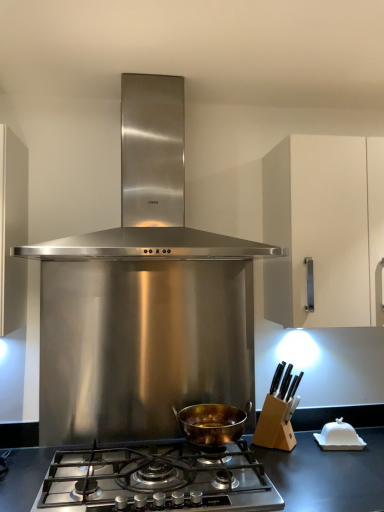
This screenshot has height=512, width=384. In order to click on gold-bronze pot at center, which ranks as the 1th kitchen appliance in bottom-to-top order in this screenshot , I will do `click(212, 423)`.

Where is `white matte cabinet at right`? white matte cabinet at right is located at coordinates (324, 228).

This screenshot has width=384, height=512. What are the coordinates of `stainless steel gas stove at center` in the screenshot? It's located at (157, 480).

From the image's perspective, is gold-bronze pot at center, which ranks as the second kitchen appliance in top-to-bottom order, under white matte cabinet at right?

Yes, from the image's perspective, gold-bronze pot at center, which ranks as the second kitchen appliance in top-to-bottom order, is below white matte cabinet at right.

Is gold-bronze pot at center, which ranks as the second kitchen appliance in top-to-bottom order, situated inside white matte cabinet at right or outside?

gold-bronze pot at center, which ranks as the second kitchen appliance in top-to-bottom order, is not enclosed by white matte cabinet at right.

Is gold-bronze pot at center, which ranks as the 1th kitchen appliance in bottom-to-top order, looking in the opposite direction of white matte cabinet at right?

No, white matte cabinet at right is not at the back of gold-bronze pot at center, which ranks as the 1th kitchen appliance in bottom-to-top order.

How far apart are gold-bronze pot at center, which ranks as the 1th kitchen appliance in bottom-to-top order, and white matte cabinet at right?

A distance of 28.57 inches exists between gold-bronze pot at center, which ranks as the 1th kitchen appliance in bottom-to-top order, and white matte cabinet at right.

Is white matte cabinet at right positioned beyond the bounds of gold-bronze pot at center, which ranks as the 1th kitchen appliance in bottom-to-top order?

Indeed, white matte cabinet at right is completely outside gold-bronze pot at center, which ranks as the 1th kitchen appliance in bottom-to-top order.

How far apart are white matte cabinet at right and gold-bronze pot at center, which ranks as the second kitchen appliance in top-to-bottom order?

white matte cabinet at right is 28.57 inches away from gold-bronze pot at center, which ranks as the second kitchen appliance in top-to-bottom order.

Is white matte cabinet at right beside gold-bronze pot at center, which ranks as the 1th kitchen appliance in bottom-to-top order?

No, white matte cabinet at right is not beside gold-bronze pot at center, which ranks as the 1th kitchen appliance in bottom-to-top order.

Between gold-bronze pot at center, which ranks as the 1th kitchen appliance in bottom-to-top order, and stainless steel gas stove at center, which one appears on the right side from the viewer's perspective?

gold-bronze pot at center, which ranks as the 1th kitchen appliance in bottom-to-top order, is more to the right.

Can you tell me how much gold-bronze pot at center, which ranks as the second kitchen appliance in top-to-bottom order, and stainless steel gas stove at center differ in facing direction?

gold-bronze pot at center, which ranks as the second kitchen appliance in top-to-bottom order, and stainless steel gas stove at center are facing 0.000546 degrees away from each other.

From a real-world perspective, who is located lower, gold-bronze pot at center, which ranks as the second kitchen appliance in top-to-bottom order, or stainless steel gas stove at center?

In real-world perspective, stainless steel gas stove at center is lower.

From the image's perspective, who appears lower, gold-bronze pot at center, which ranks as the 1th kitchen appliance in bottom-to-top order, or stainless steel gas stove at center?

From the image's view, stainless steel gas stove at center is below.

Considering the relative sizes of stainless steel range hood at center, which is counted as the 2th kitchen appliance, starting from the bottom, and stainless steel gas stove at center in the image provided, is stainless steel range hood at center, which is counted as the 2th kitchen appliance, starting from the bottom, shorter than stainless steel gas stove at center?

Incorrect, the height of stainless steel range hood at center, which is counted as the 2th kitchen appliance, starting from the bottom, does not fall short of that of stainless steel gas stove at center.

Relative to stainless steel gas stove at center, is stainless steel range hood at center, which ranks as the first kitchen appliance in top-to-bottom order, in front or behind?

stainless steel range hood at center, which ranks as the first kitchen appliance in top-to-bottom order, is positioned farther from the viewer than stainless steel gas stove at center.

Does stainless steel range hood at center, which ranks as the first kitchen appliance in top-to-bottom order, touch stainless steel gas stove at center?

There is a gap between stainless steel range hood at center, which ranks as the first kitchen appliance in top-to-bottom order, and stainless steel gas stove at center.

Does point (159, 217) come closer to viewer compared to point (187, 474)?

No, it is not.

Is stainless steel gas stove at center touching stainless steel range hood at center, which ranks as the first kitchen appliance in top-to-bottom order?

No, stainless steel gas stove at center is not making contact with stainless steel range hood at center, which ranks as the first kitchen appliance in top-to-bottom order.

From their relative heights in the image, would you say stainless steel gas stove at center is taller or shorter than stainless steel range hood at center, which ranks as the first kitchen appliance in top-to-bottom order?

Clearly, stainless steel gas stove at center is shorter compared to stainless steel range hood at center, which ranks as the first kitchen appliance in top-to-bottom order.

In the scene shown: Is stainless steel gas stove at center facing towards stainless steel range hood at center, which is counted as the 2th kitchen appliance, starting from the bottom?

No, stainless steel gas stove at center does not turn towards stainless steel range hood at center, which is counted as the 2th kitchen appliance, starting from the bottom.

From a real-world perspective, is stainless steel gas stove at center on stainless steel range hood at center, which ranks as the first kitchen appliance in top-to-bottom order?

No, from a real-world perspective, stainless steel gas stove at center is not on top of stainless steel range hood at center, which ranks as the first kitchen appliance in top-to-bottom order.

Is stainless steel gas stove at center placed right next to gold-bronze pot at center, which ranks as the second kitchen appliance in top-to-bottom order?

No, stainless steel gas stove at center is not beside gold-bronze pot at center, which ranks as the second kitchen appliance in top-to-bottom order.

Where is `the 1st kitchen appliance directly above the stainless steel gas stove at center (from a real-world perspective)`? Image resolution: width=384 pixels, height=512 pixels. the 1st kitchen appliance directly above the stainless steel gas stove at center (from a real-world perspective) is located at coordinates (212, 423).

Is gold-bronze pot at center, which ranks as the second kitchen appliance in top-to-bottom order, a part of stainless steel gas stove at center?

No, gold-bronze pot at center, which ranks as the second kitchen appliance in top-to-bottom order, is located outside of stainless steel gas stove at center.

Does stainless steel range hood at center, which ranks as the first kitchen appliance in top-to-bottom order, appear on the left side of gold-bronze pot at center, which ranks as the 1th kitchen appliance in bottom-to-top order?

Yes.

What's the angular difference between stainless steel range hood at center, which is counted as the 2th kitchen appliance, starting from the bottom, and gold-bronze pot at center, which ranks as the second kitchen appliance in top-to-bottom order,'s facing directions?

stainless steel range hood at center, which is counted as the 2th kitchen appliance, starting from the bottom, and gold-bronze pot at center, which ranks as the second kitchen appliance in top-to-bottom order, are facing 0.0435 degrees away from each other.

Is stainless steel range hood at center, which ranks as the first kitchen appliance in top-to-bottom order, aimed at gold-bronze pot at center, which ranks as the second kitchen appliance in top-to-bottom order?

No, stainless steel range hood at center, which ranks as the first kitchen appliance in top-to-bottom order, is not facing towards gold-bronze pot at center, which ranks as the second kitchen appliance in top-to-bottom order.

Where is `kitchen appliance in front of the gold-bronze pot at center, which ranks as the second kitchen appliance in top-to-bottom order`? kitchen appliance in front of the gold-bronze pot at center, which ranks as the second kitchen appliance in top-to-bottom order is located at coordinates (145, 184).

I want to click on kitchen appliance that is under the white matte cabinet at right (from a real-world perspective), so click(212, 423).

In order to click on cabinetry behind the gold-bronze pot at center, which ranks as the second kitchen appliance in top-to-bottom order in this screenshot , I will do `click(324, 228)`.

When comparing their distances from stainless steel gas stove at center, does white matte cabinet at right or gold-bronze pot at center, which ranks as the 1th kitchen appliance in bottom-to-top order, seem further?

white matte cabinet at right lies further to stainless steel gas stove at center than the other object.

Based on their spatial positions, is stainless steel range hood at center, which is counted as the 2th kitchen appliance, starting from the bottom, or stainless steel gas stove at center closer to white matte cabinet at right?

Among the two, stainless steel range hood at center, which is counted as the 2th kitchen appliance, starting from the bottom, is located nearer to white matte cabinet at right.

Based on their spatial positions, is white matte cabinet at right or stainless steel range hood at center, which ranks as the first kitchen appliance in top-to-bottom order, closer to stainless steel gas stove at center?

The object closer to stainless steel gas stove at center is white matte cabinet at right.

When comparing their distances from stainless steel range hood at center, which ranks as the first kitchen appliance in top-to-bottom order, does stainless steel gas stove at center or white matte cabinet at right seem further?

Based on the image, stainless steel gas stove at center appears to be further to stainless steel range hood at center, which ranks as the first kitchen appliance in top-to-bottom order.

When comparing their distances from stainless steel range hood at center, which is counted as the 2th kitchen appliance, starting from the bottom, does gold-bronze pot at center, which ranks as the second kitchen appliance in top-to-bottom order, or white matte cabinet at right seem further?

gold-bronze pot at center, which ranks as the second kitchen appliance in top-to-bottom order.

Estimate the real-world distances between objects in this image. Which object is further from white matte cabinet at right, stainless steel range hood at center, which ranks as the first kitchen appliance in top-to-bottom order, or gold-bronze pot at center, which ranks as the 1th kitchen appliance in bottom-to-top order?

The object further to white matte cabinet at right is gold-bronze pot at center, which ranks as the 1th kitchen appliance in bottom-to-top order.

When comparing their distances from stainless steel range hood at center, which is counted as the 2th kitchen appliance, starting from the bottom, does stainless steel gas stove at center or gold-bronze pot at center, which ranks as the second kitchen appliance in top-to-bottom order, seem closer?

stainless steel gas stove at center is positioned closer to the anchor stainless steel range hood at center, which is counted as the 2th kitchen appliance, starting from the bottom.

Estimate the real-world distances between objects in this image. Which object is further from white matte cabinet at right, gold-bronze pot at center, which ranks as the 1th kitchen appliance in bottom-to-top order, or stainless steel gas stove at center?

Based on the image, stainless steel gas stove at center appears to be further to white matte cabinet at right.

Where is `cabinetry between stainless steel range hood at center, which is counted as the 2th kitchen appliance, starting from the bottom, and stainless steel gas stove at center, in the vertical direction`? The height and width of the screenshot is (512, 384). cabinetry between stainless steel range hood at center, which is counted as the 2th kitchen appliance, starting from the bottom, and stainless steel gas stove at center, in the vertical direction is located at coordinates (324, 228).

The height and width of the screenshot is (512, 384). I want to click on kitchen appliance between white matte cabinet at right and stainless steel gas stove at center in the up-down direction, so pos(212,423).

Identify the location of kitchen appliance that lies between stainless steel range hood at center, which is counted as the 2th kitchen appliance, starting from the bottom, and stainless steel gas stove at center from top to bottom. (212, 423).

In order to click on cabinetry between stainless steel range hood at center, which is counted as the 2th kitchen appliance, starting from the bottom, and gold-bronze pot at center, which ranks as the 1th kitchen appliance in bottom-to-top order, in the up-down direction in this screenshot , I will do `click(324, 228)`.